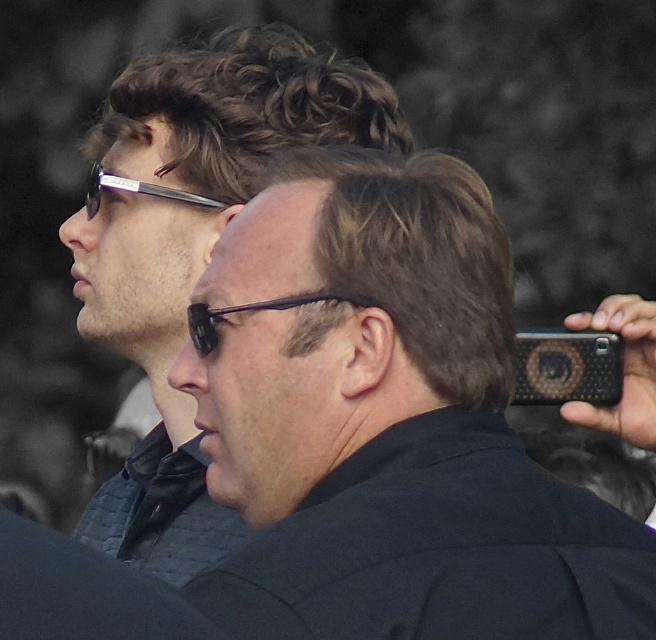
Question: Is polka dot fabric phone at right to the right of black plastic glasses at center from the viewer's perspective?

Choices:
 (A) no
 (B) yes

Answer: (B)

Question: Which point is farther from the camera taking this photo?

Choices:
 (A) (619, 388)
 (B) (178, 234)

Answer: (B)

Question: Which of the following is the farthest from the observer?

Choices:
 (A) 531,371
 (B) 298,77
 (C) 203,349

Answer: (B)

Question: Can you confirm if matte black sunglasses at upper left is bigger than matte black goggles at upper left?

Choices:
 (A) no
 (B) yes

Answer: (B)

Question: Based on their relative distances, which object is farther from the polka dot fabric phone at right?

Choices:
 (A) matte black sunglasses at upper left
 (B) matte black goggles at upper left
 (C) black plastic glasses at center

Answer: (B)

Question: Is polka dot fabric phone at right further to camera compared to black plastic glasses at center?

Choices:
 (A) yes
 (B) no

Answer: (A)